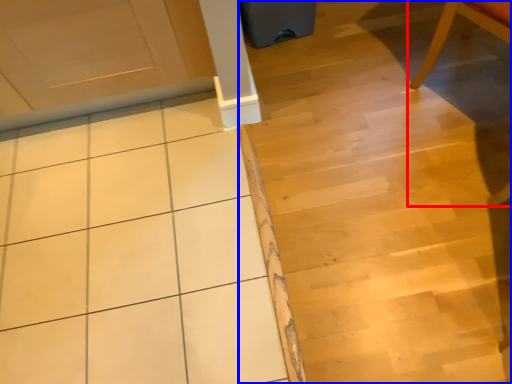
Question: Which object is closer to the camera taking this photo, chair (highlighted by a red box) or stair (highlighted by a blue box)?

Choices:
 (A) chair
 (B) stair

Answer: (A)